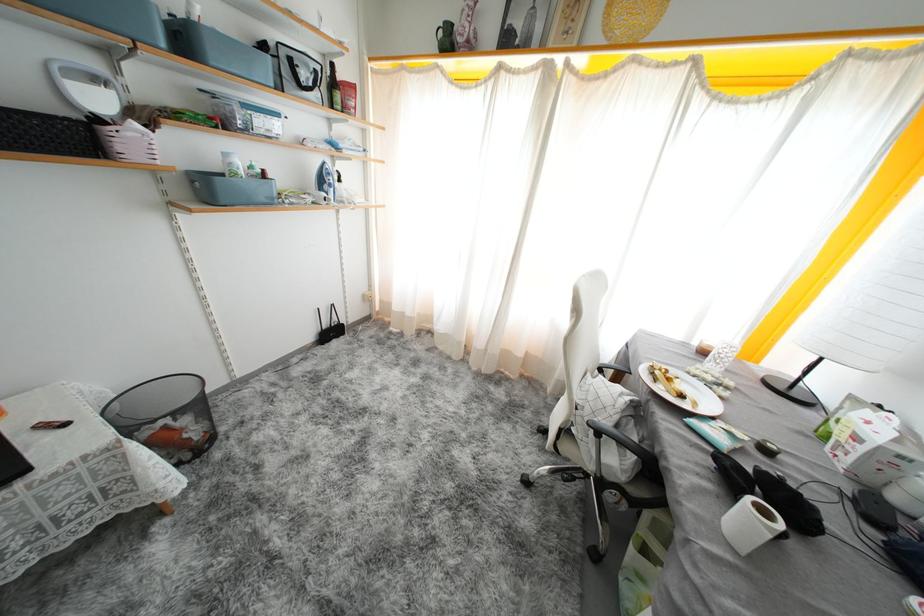
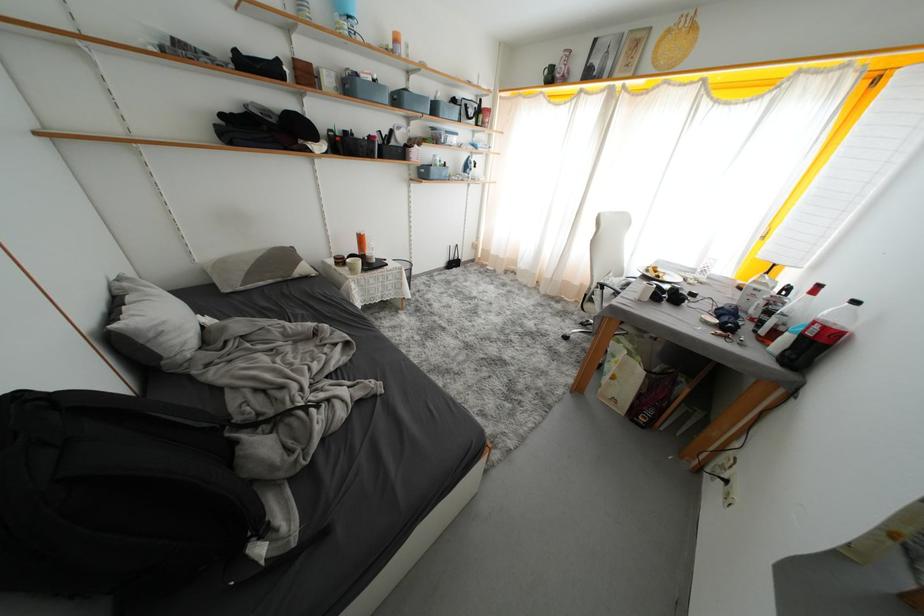
Where in the second image is the point corresponding to [687,400] from the first image?

(664, 281)